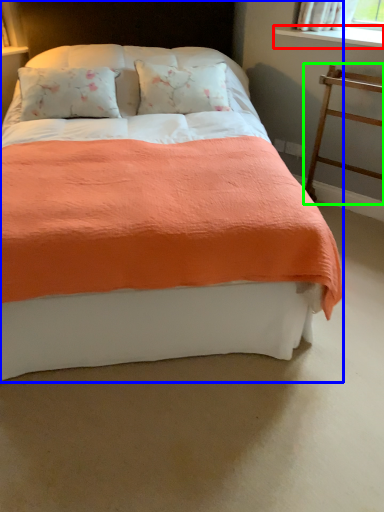
Question: Estimate the real-world distances between objects in this image. Which object is closer to window sill (highlighted by a red box), bed (highlighted by a blue box) or balustrade (highlighted by a green box)?

Choices:
 (A) bed
 (B) balustrade

Answer: (B)